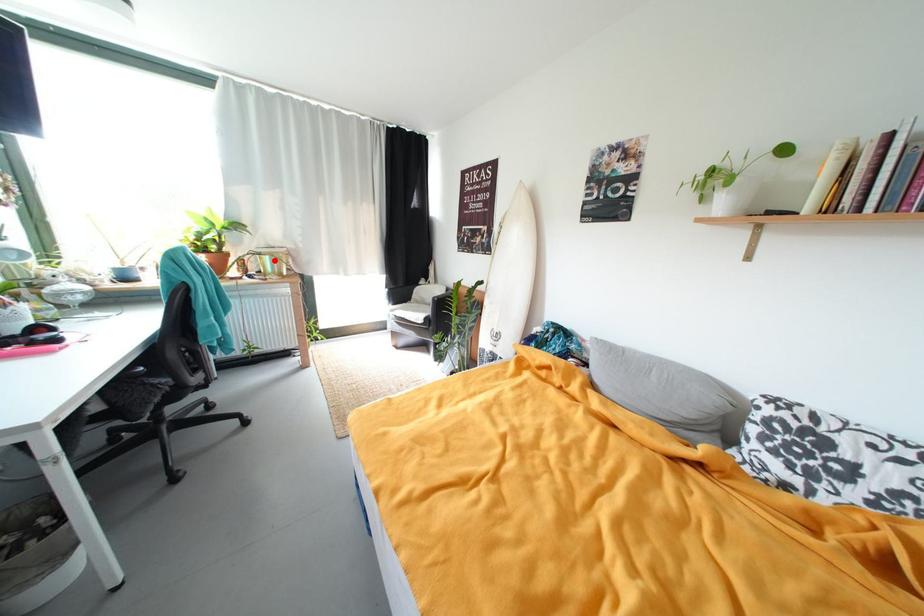
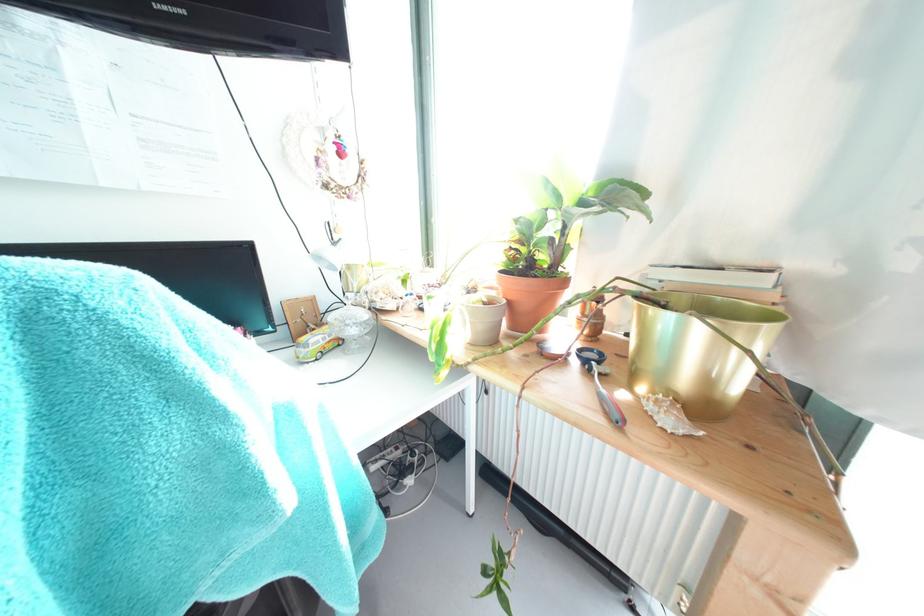
Where in the second image is the point corresponding to the highlighted location from the first image?

(675, 321)